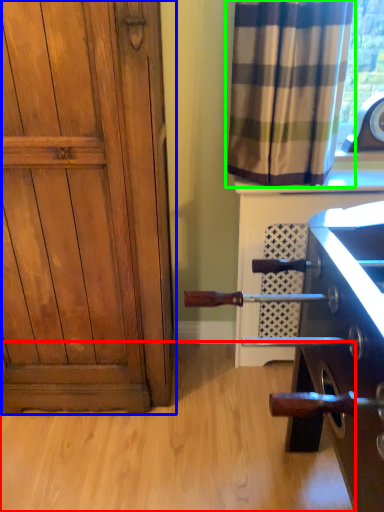
Question: Considering the real-world distances, which object is closest to plain (highlighted by a red box)? door (highlighted by a blue box) or curtain (highlighted by a green box).

Choices:
 (A) door
 (B) curtain

Answer: (A)